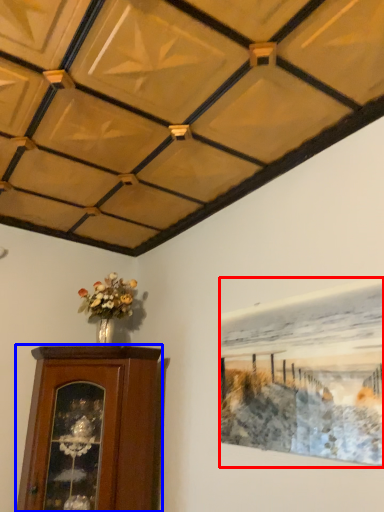
Question: Which of the following is the farthest to the observer, picture frame (highlighted by a red box) or furniture (highlighted by a blue box)?

Choices:
 (A) picture frame
 (B) furniture

Answer: (B)